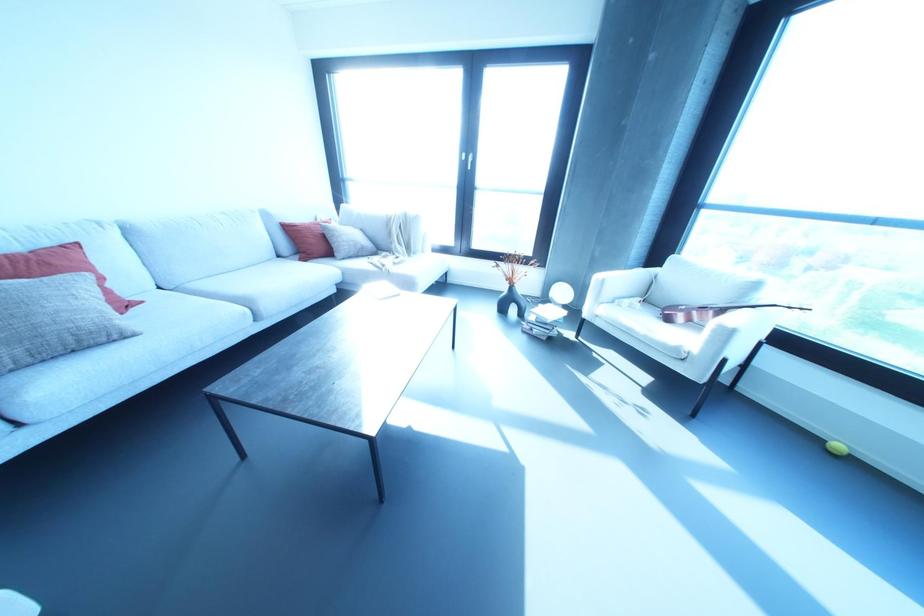
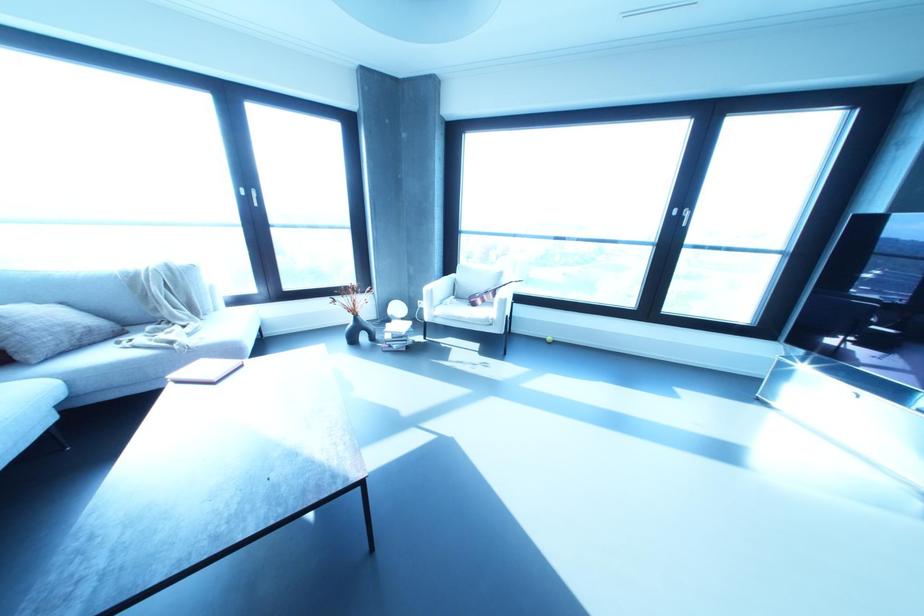
Find the pixel in the second image that matches [520,314] in the first image.

(371, 338)